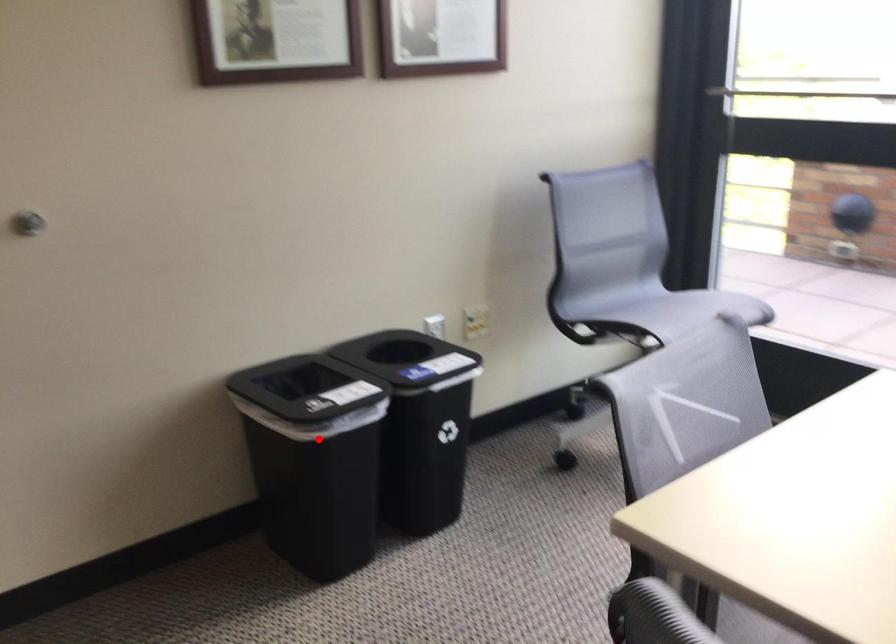
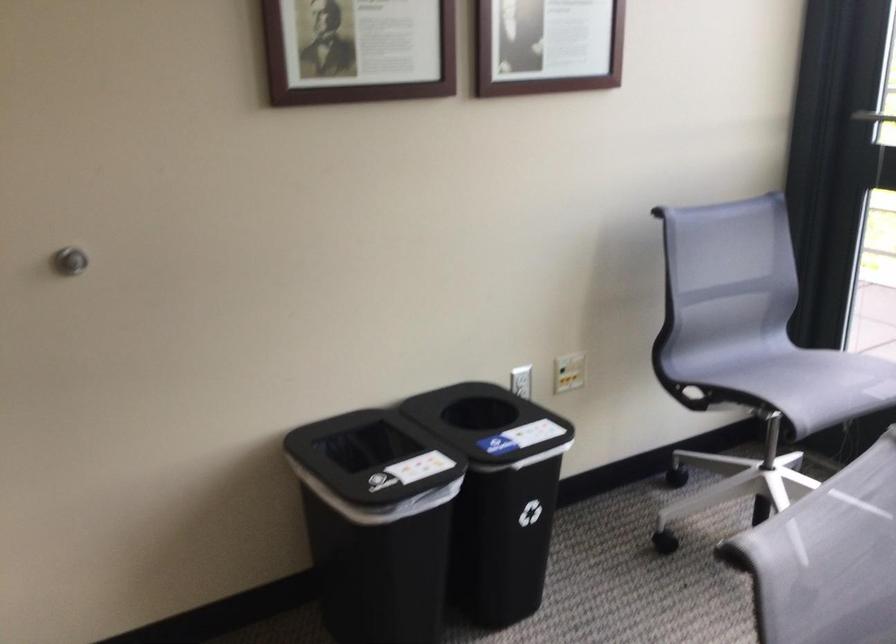
Question: I am providing you with two images of the same scene from different viewpoints. Given a red point in image1, look at the same physical point in image2. Is it:

Choices:
 (A) Closer to the viewpoint
 (B) Farther from the viewpoint

Answer: (A)